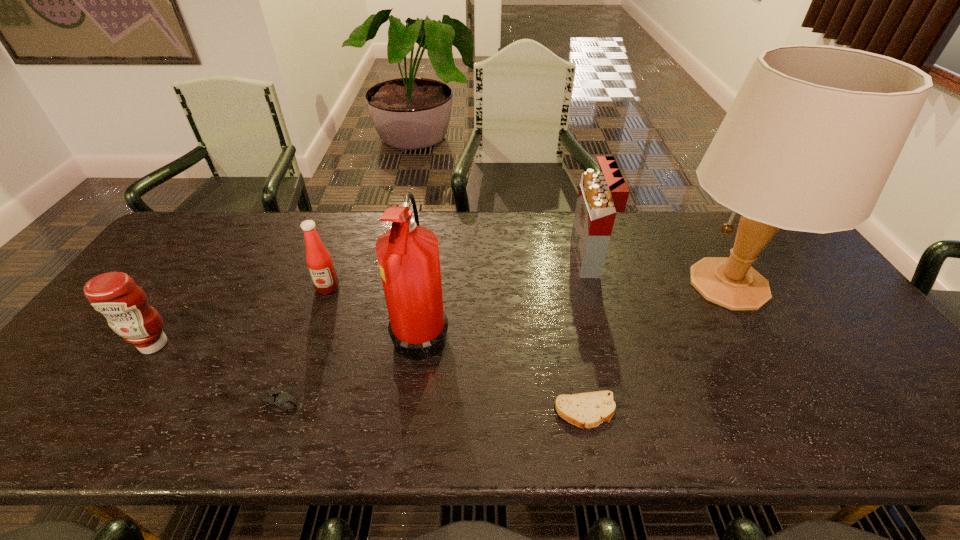
Image resolution: width=960 pixels, height=540 pixels. In order to click on free region located on the front of the rightmost object in this screenshot , I will do `click(802, 407)`.

I want to click on free space located 0.080m at the spray nozzle of the sixth shortest object, so click(x=481, y=330).

Locate an element on the screen. The width and height of the screenshot is (960, 540). vacant space located with the lid open on the third tallest object is located at coordinates pyautogui.click(x=468, y=258).

You are a GUI agent. You are given a task and a screenshot of the screen. Output one action in this format:
    pyautogui.click(x=<x>, y=<y>)
    Task: Click on the free space located with the lid open on the third tallest object
    The width and height of the screenshot is (960, 540).
    Given the screenshot: What is the action you would take?
    pyautogui.click(x=510, y=258)

Locate an element on the screen. Image resolution: width=960 pixels, height=540 pixels. blank space located with the lid open on the third tallest object is located at coordinates (454, 258).

Find the location of a particular element. The height and width of the screenshot is (540, 960). vacant space situated on the front-facing side of the right condiment is located at coordinates (312, 331).

You are a GUI agent. You are given a task and a screenshot of the screen. Output one action in this format:
    pyautogui.click(x=<x>, y=<y>)
    Task: Click on the vacant space situated 0.060m on the left of the nearer condiment
    The width and height of the screenshot is (960, 540).
    Given the screenshot: What is the action you would take?
    pyautogui.click(x=108, y=345)

Image resolution: width=960 pixels, height=540 pixels. Identify the location of vacant space positioned 0.110m on the left of the computer mouse. (207, 402).

This screenshot has width=960, height=540. In order to click on vacant space located 0.180m on the right of the pita bread in this screenshot , I will do `click(698, 411)`.

This screenshot has width=960, height=540. I want to click on table lamp that is positioned at the far edge, so click(x=810, y=140).